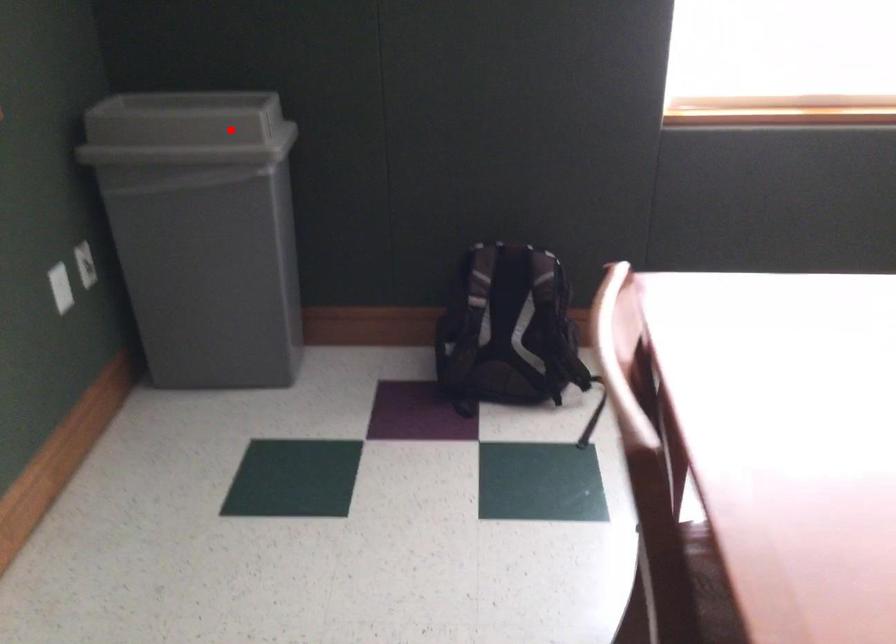
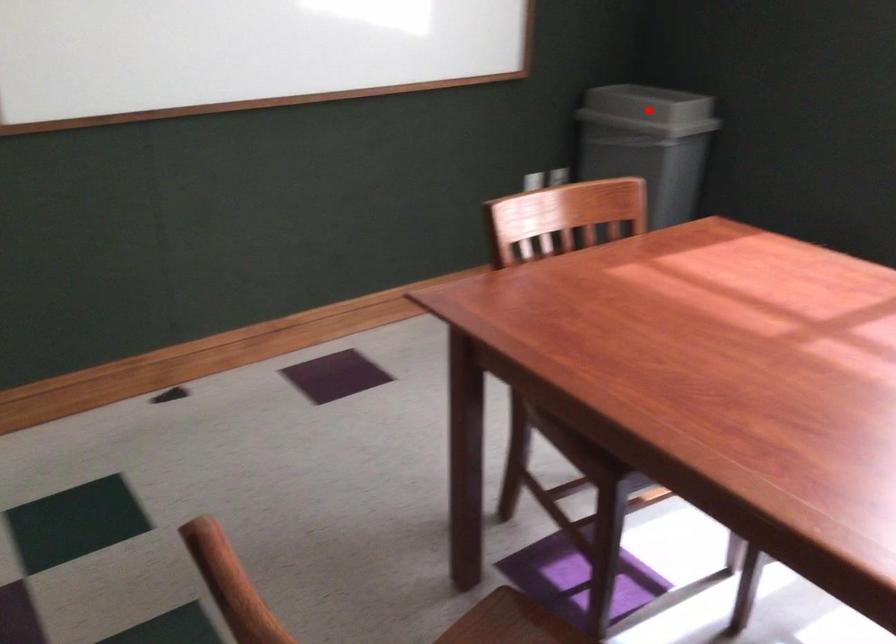
I am providing you with two images of the same scene from different viewpoints. A red point is marked on the first image and another point is marked on the second image. Is the red point in image1 aligned with the point shown in image2?

Yes